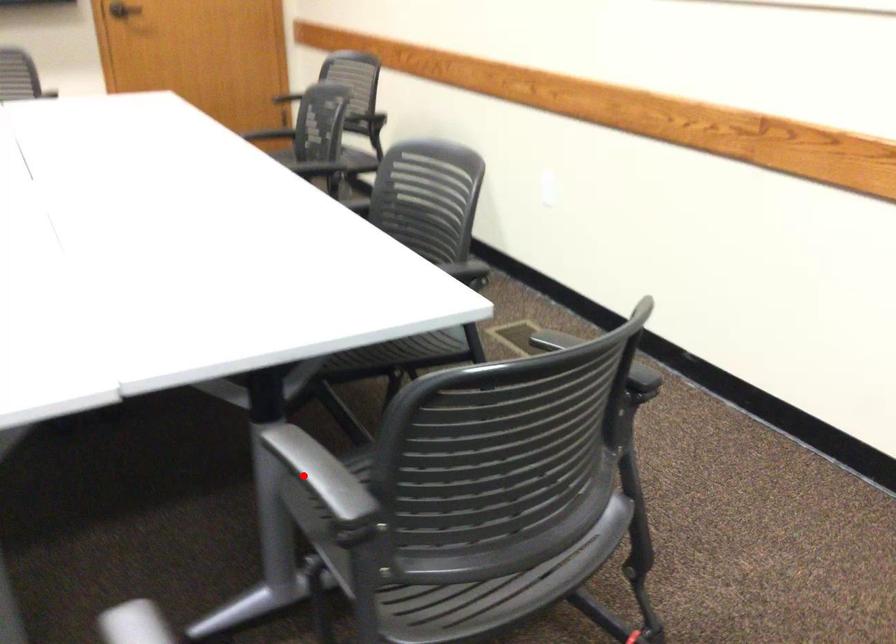
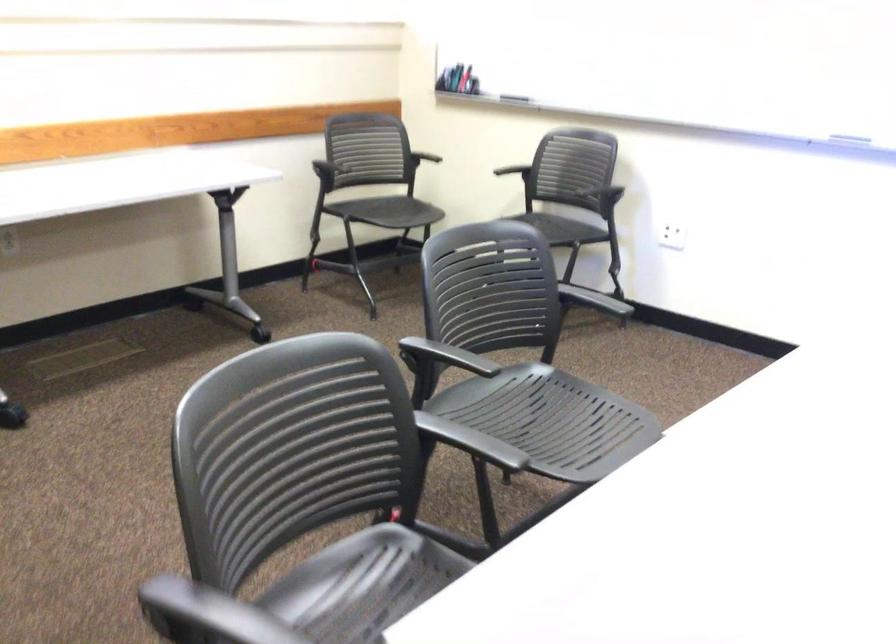
Find the pixel in the second image that matches the highlighted location in the first image.

(471, 442)